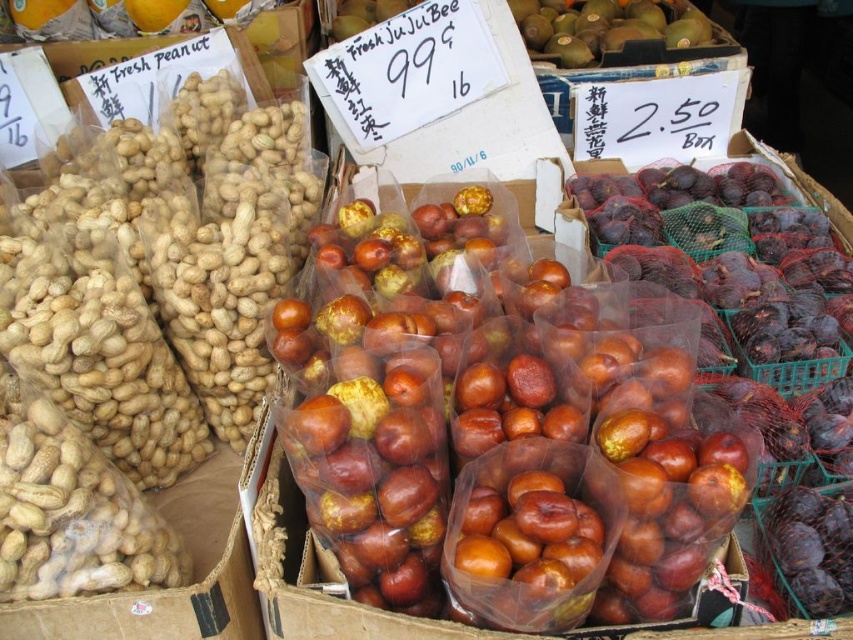
You are a customer at the market stall and want to pick up the shiny brown apples at center and the green matte kiwi at upper center. Which one is easier to reach?

The shiny brown apples at center is easier to reach because it is in front of the green matte kiwi at upper center.

You are a customer at the market stall and want to buy fruits. You see the shiny brown apples at center and the green matte kiwi at upper center. Which fruit is taller?

The shiny brown apples at center are taller than the green matte kiwi at upper center according to the description provided.